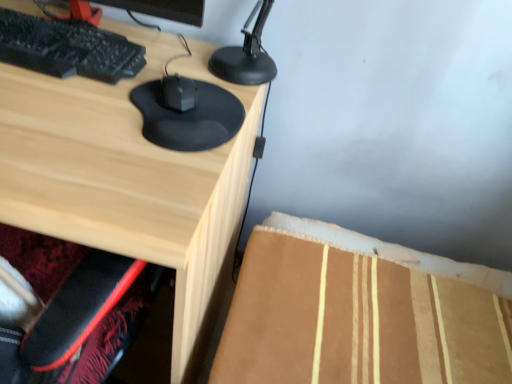
Find the location of a particular element. The width and height of the screenshot is (512, 384). blank space above matte wood desk at center (from a real-world perspective) is located at coordinates (117, 102).